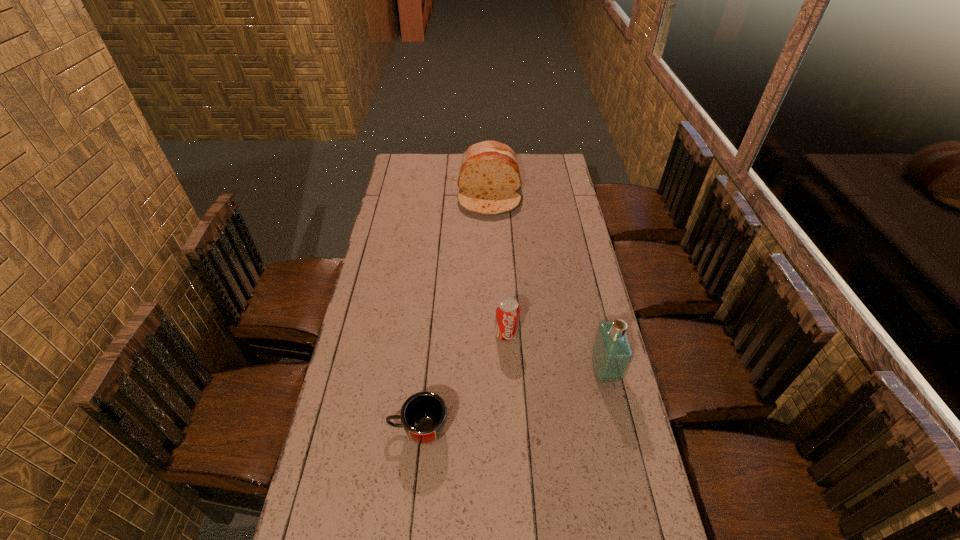
What are the coordinates of `vacant region at the left edge of the desktop` in the screenshot? It's located at (371, 308).

Image resolution: width=960 pixels, height=540 pixels. In the image, there is a desktop. What are the coordinates of `vacant space at the right edge` in the screenshot? It's located at (584, 249).

The height and width of the screenshot is (540, 960). What are the coordinates of `free space between the farthest object and the tallest object` in the screenshot? It's located at [x=547, y=282].

The image size is (960, 540). In order to click on vacant area that lies between the farthest object and the tallest object in this screenshot , I will do `click(547, 282)`.

This screenshot has height=540, width=960. I want to click on vacant area that lies between the nearest object and the third nearest object, so click(x=463, y=382).

I want to click on vacant space that is in between the bread and the rightmost object, so click(547, 282).

Find the location of a particular element. free space between the mug and the farthest object is located at coordinates (454, 311).

I want to click on vacant point located between the shortest object and the tallest object, so click(x=512, y=400).

The width and height of the screenshot is (960, 540). Identify the location of free point between the bread and the tallest object. (547, 282).

At what (x,y) coordinates should I click in order to perform the action: click on free space between the third shortest object and the tallest object. Please return your answer as a coordinate pair (x, y). Image resolution: width=960 pixels, height=540 pixels. Looking at the image, I should click on (547, 282).